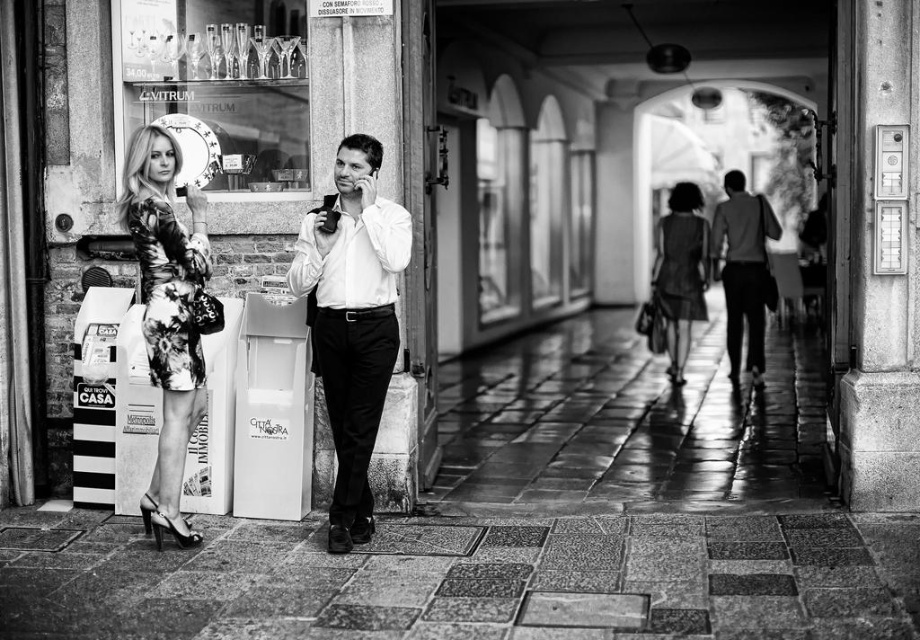
Question: Is granite tiles at center positioned in front of smooth white shirt at center?

Choices:
 (A) yes
 (B) no

Answer: (A)

Question: Estimate the real-world distances between objects in this image. Which object is closer to the granite tiles at center?

Choices:
 (A) floral-patterned dress at left
 (B) dark gray suit at center
 (C) polished stone pavement at center
 (D) silky black dress at center

Answer: (A)

Question: Which of the following is the farthest from the observer?

Choices:
 (A) smooth white shirt at center
 (B) floral dress at left
 (C) polished stone pavement at center

Answer: (C)

Question: Is floral dress at left closer to the viewer compared to silky black dress at center?

Choices:
 (A) no
 (B) yes

Answer: (B)

Question: Does granite tiles at center lie in front of smooth white shirt at center?

Choices:
 (A) yes
 (B) no

Answer: (A)

Question: Which point is farther from the camera taking this photo?

Choices:
 (A) (191, 326)
 (B) (667, 304)

Answer: (B)